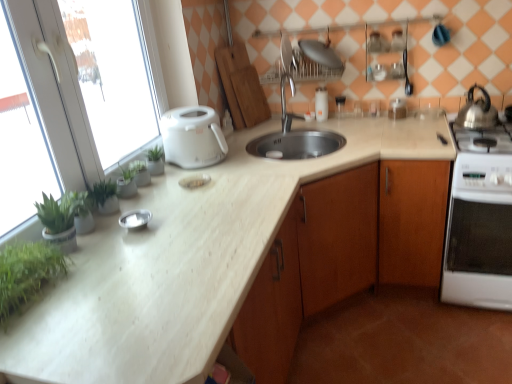
Question: From a real-world perspective, is silver metallic faucet at center beneath green leafy plant at left?

Choices:
 (A) no
 (B) yes

Answer: (A)

Question: Does silver metallic faucet at center have a greater height compared to green leafy plant at left?

Choices:
 (A) yes
 (B) no

Answer: (A)

Question: Is silver metallic faucet at center thinner than green leafy plant at left?

Choices:
 (A) no
 (B) yes

Answer: (A)

Question: Is silver metallic faucet at center to the left of green leafy plant at left from the viewer's perspective?

Choices:
 (A) yes
 (B) no

Answer: (B)

Question: From the image's perspective, is silver metallic faucet at center over green leafy plant at left?

Choices:
 (A) yes
 (B) no

Answer: (A)

Question: Would you say silver metallic bowl at center, which is the first appliance from left to right, is inside or outside white glossy salt shaker at upper center, which ranks as the first appliance in back-to-front order?

Choices:
 (A) outside
 (B) inside

Answer: (A)

Question: Considering the positions of silver metallic bowl at center, which is the 1th appliance from front to back, and white glossy salt shaker at upper center, which ranks as the first appliance in back-to-front order, in the image, is silver metallic bowl at center, which is the 1th appliance from front to back, wider or thinner than white glossy salt shaker at upper center, which ranks as the first appliance in back-to-front order,?

Choices:
 (A) thin
 (B) wide

Answer: (B)

Question: From a real-world perspective, is silver metallic bowl at center, which ranks as the fourth appliance in back-to-front order, above or below white glossy salt shaker at upper center, the 4th appliance positioned from the front?

Choices:
 (A) above
 (B) below

Answer: (B)

Question: In the image, is silver metallic bowl at center, which is the 1th appliance from front to back, positioned in front of or behind white glossy salt shaker at upper center, which ranks as the first appliance in back-to-front order?

Choices:
 (A) behind
 (B) front

Answer: (B)

Question: Is white glossy oven at right taller or shorter than metallic silver plate at upper center, which ranks as the second appliance in left-to-right order?

Choices:
 (A) short
 (B) tall

Answer: (B)

Question: Considering the positions of white glossy oven at right and metallic silver plate at upper center, the 4th appliance ordered from the bottom, in the image, is white glossy oven at right wider or thinner than metallic silver plate at upper center, the 4th appliance ordered from the bottom,?

Choices:
 (A) thin
 (B) wide

Answer: (B)

Question: Is white glossy oven at right spatially inside metallic silver plate at upper center, acting as the 3th appliance starting from the back, or outside of it?

Choices:
 (A) inside
 (B) outside

Answer: (B)

Question: From a real-world perspective, is white glossy oven at right above or below metallic silver plate at upper center, the 4th appliance ordered from the bottom?

Choices:
 (A) above
 (B) below

Answer: (B)

Question: Which is correct: silver metallic faucet at center is inside green leafy plant at left, or outside of it?

Choices:
 (A) outside
 (B) inside

Answer: (A)

Question: From a real-world perspective, is silver metallic faucet at center above or below green leafy plant at left?

Choices:
 (A) below
 (B) above

Answer: (A)